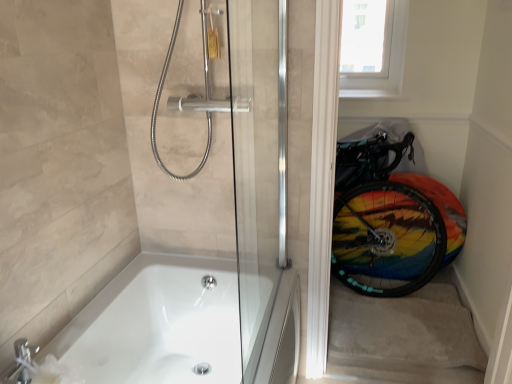
Question: From the image's perspective, does white plastic window screen at upper right appear lower than transparent glass door at right?

Choices:
 (A) no
 (B) yes

Answer: (A)

Question: Is white plastic window screen at upper right bigger than transparent glass door at right?

Choices:
 (A) no
 (B) yes

Answer: (A)

Question: Is white plastic window screen at upper right placed right next to transparent glass door at right?

Choices:
 (A) yes
 (B) no

Answer: (B)

Question: Is transparent glass door at right located within white plastic window screen at upper right?

Choices:
 (A) no
 (B) yes

Answer: (A)

Question: Considering the relative sizes of white plastic window screen at upper right and transparent glass door at right in the image provided, is white plastic window screen at upper right smaller than transparent glass door at right?

Choices:
 (A) yes
 (B) no

Answer: (A)

Question: Can you confirm if white plastic window screen at upper right is wider than transparent glass door at right?

Choices:
 (A) yes
 (B) no

Answer: (B)

Question: Could you tell me if carpeted stairwell at lower right is turned towards transparent glass door at right?

Choices:
 (A) yes
 (B) no

Answer: (A)

Question: From the image's perspective, would you say carpeted stairwell at lower right is shown under transparent glass door at right?

Choices:
 (A) yes
 (B) no

Answer: (A)

Question: Considering the relative sizes of carpeted stairwell at lower right and transparent glass door at right in the image provided, is carpeted stairwell at lower right bigger than transparent glass door at right?

Choices:
 (A) yes
 (B) no

Answer: (B)

Question: Does carpeted stairwell at lower right have a lesser height compared to transparent glass door at right?

Choices:
 (A) no
 (B) yes

Answer: (B)

Question: Is carpeted stairwell at lower right to the right of transparent glass door at right from the viewer's perspective?

Choices:
 (A) yes
 (B) no

Answer: (A)

Question: Can you confirm if carpeted stairwell at lower right is wider than transparent glass door at right?

Choices:
 (A) yes
 (B) no

Answer: (A)

Question: Are white plastic window screen at upper right and white glossy bathtub at lower left far apart?

Choices:
 (A) yes
 (B) no

Answer: (A)